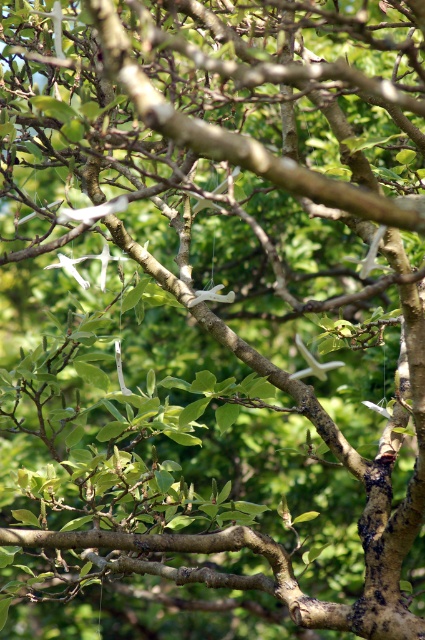
Who is lower down, white matte branch at center or white matte bird at center?

white matte branch at center

Locate an element on the screen. white matte branch at center is located at coordinates (312, 364).

Is point (320, 378) closer to camera compared to point (217, 292)?

No, it is behind (217, 292).

You are a GUI agent. You are given a task and a screenshot of the screen. Output one action in this format:
    pyautogui.click(x=<x>, y=<y>)
    Task: Click on the white matte branch at center
    This screenshot has width=425, height=640.
    Given the screenshot: What is the action you would take?
    pyautogui.click(x=312, y=364)

Does white matte bird at upper center have a lesser width compared to white matte branch at center?

Incorrect, white matte bird at upper center's width is not less than white matte branch at center's.

Is point (116, 209) more distant than point (306, 356)?

No, it is not.

Who is more distant from viewer, (74, 212) or (302, 344)?

The point (302, 344) is behind.

You are a GUI agent. You are given a task and a screenshot of the screen. Output one action in this format:
    pyautogui.click(x=<x>, y=<y>)
    Task: Click on the white matte bird at upper center
    The width and height of the screenshot is (425, 640).
    Given the screenshot: What is the action you would take?
    pyautogui.click(x=93, y=211)

Between white matte bird at upper center and white matte bird at center, which one has less height?

white matte bird at center

Which is behind, point (85, 212) or point (212, 296)?

Point (212, 296)

Find the location of a particular element. The image size is (425, 640). white matte bird at upper center is located at coordinates (93, 211).